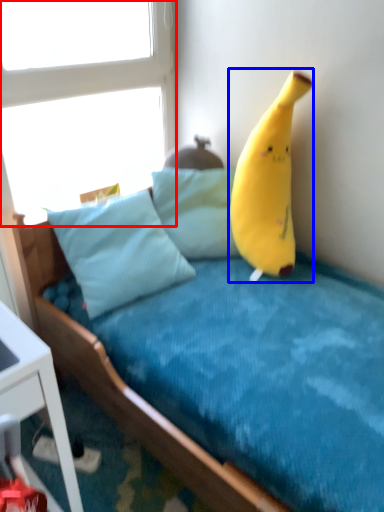
Question: Which object is closer to the camera taking this photo, window (highlighted by a red box) or banana (highlighted by a blue box)?

Choices:
 (A) window
 (B) banana

Answer: (B)